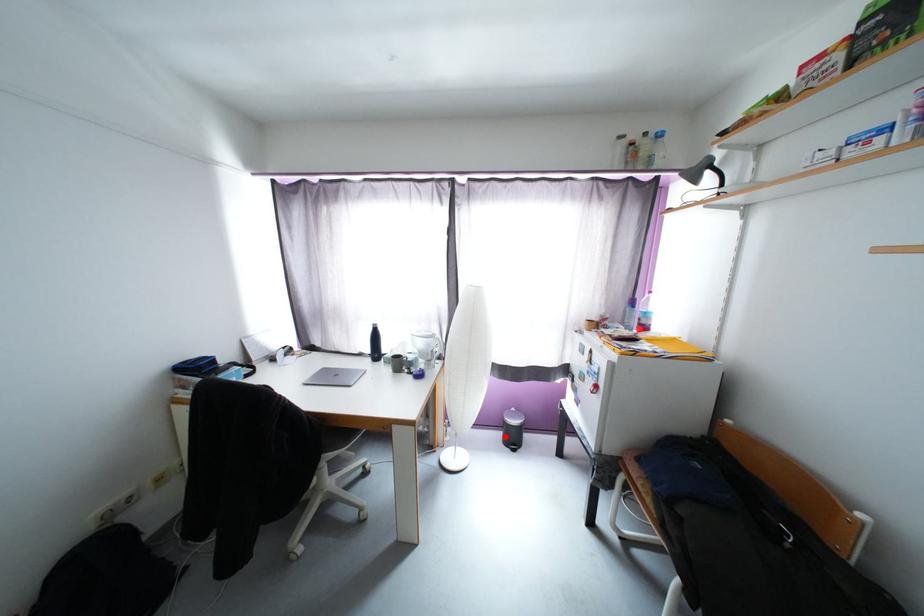
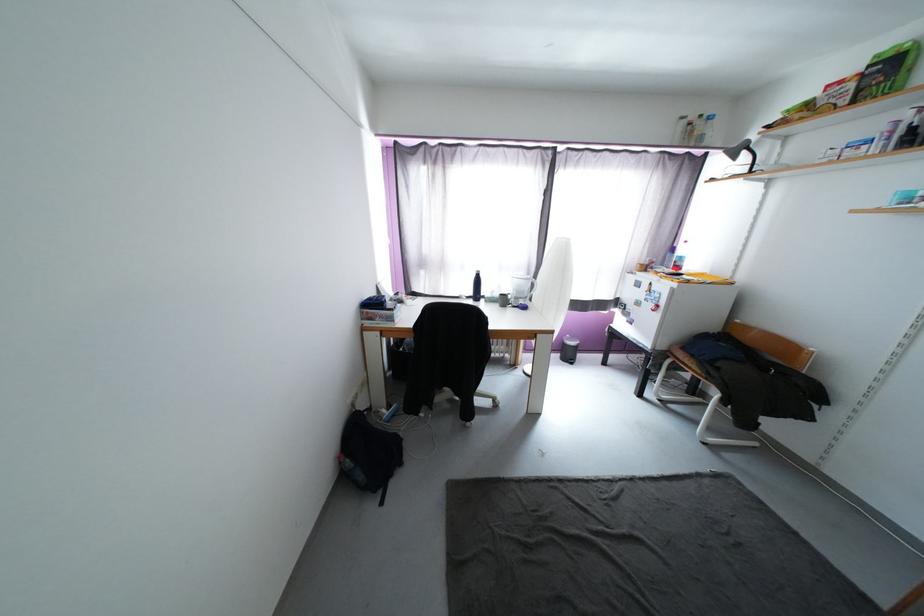
Question: I am providing you with two images of the same scene from different viewpoints. In image1, a red point is highlighted. Considering the same 3D point in image2, which of the following is correct?

Choices:
 (A) It is closer
 (B) It is farther

Answer: (B)